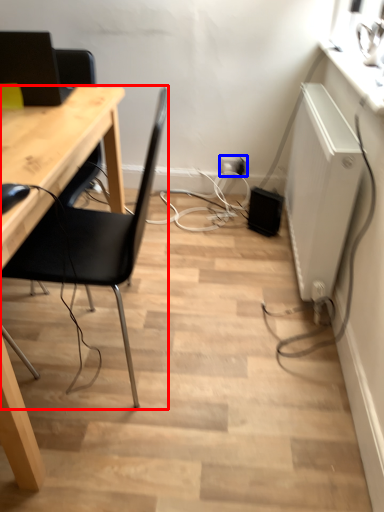
Question: Which of the following is the farthest to the observer, chair (highlighted by a red box) or electric outlet (highlighted by a blue box)?

Choices:
 (A) chair
 (B) electric outlet

Answer: (B)